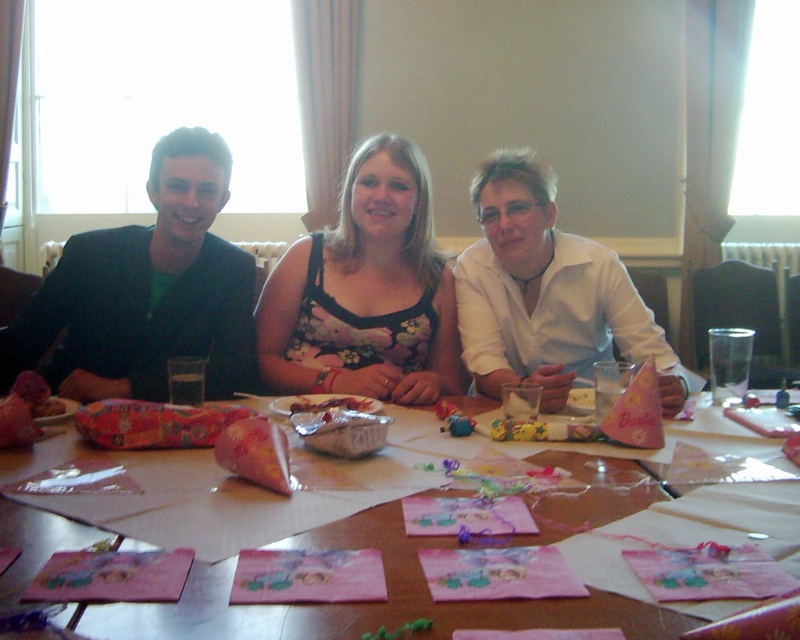
Where is the black matte jacket at left located in the image?

The black matte jacket at left is located at point (146, 291) in the image.

You are sitting at the table and want to pass a craft item from the black matte jacket at left to the floral fabric dress at center. Can you do this without moving any objects on the table?

The black matte jacket at left is in front of the floral fabric dress at center, so you can pass the craft item directly to the floral fabric dress at center without needing to move anything on the table.